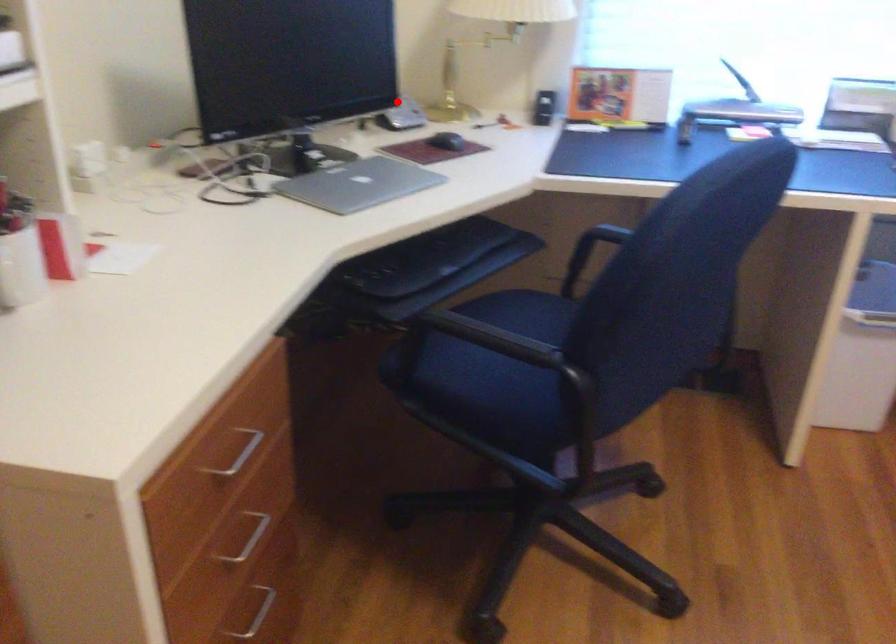
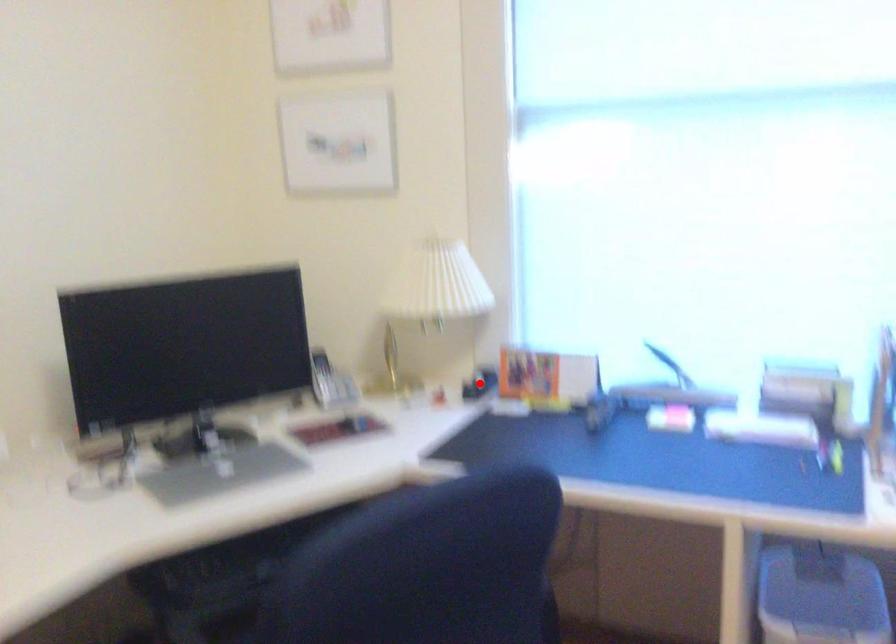
I am providing you with two images of the same scene from different viewpoints. A red point is marked on the first image and another point is marked on the second image. Is the red point in image1 aligned with the point shown in image2?

No